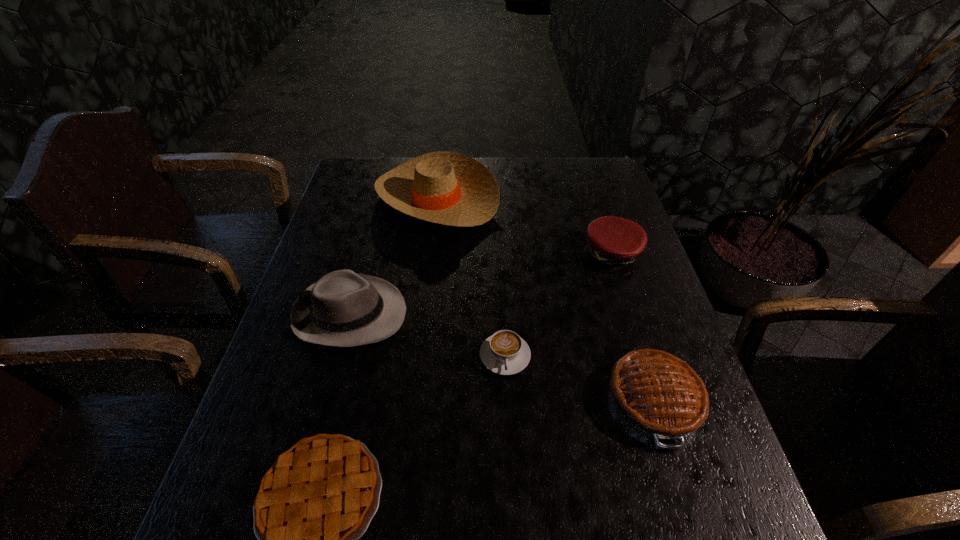
This screenshot has width=960, height=540. In order to click on blank space that satisfies the following two spatial constraints: 1. at the front of the cap where the visor is located; 2. on the front-facing side of the fedora in this screenshot , I will do `click(630, 314)`.

Image resolution: width=960 pixels, height=540 pixels. I want to click on vacant area in the image that satisfies the following two spatial constraints: 1. on the front-facing side of the fedora; 2. on the back side of the right pie, so click(326, 400).